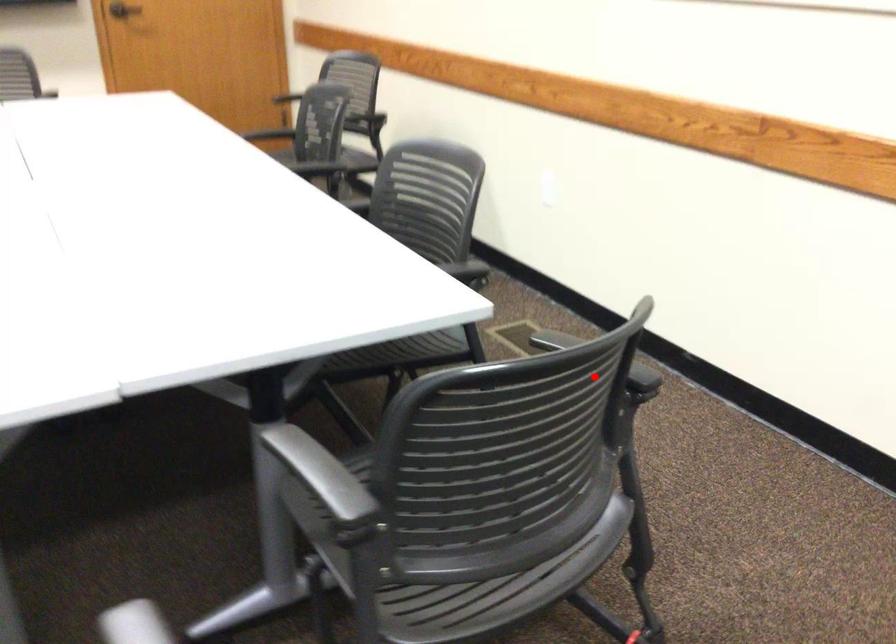
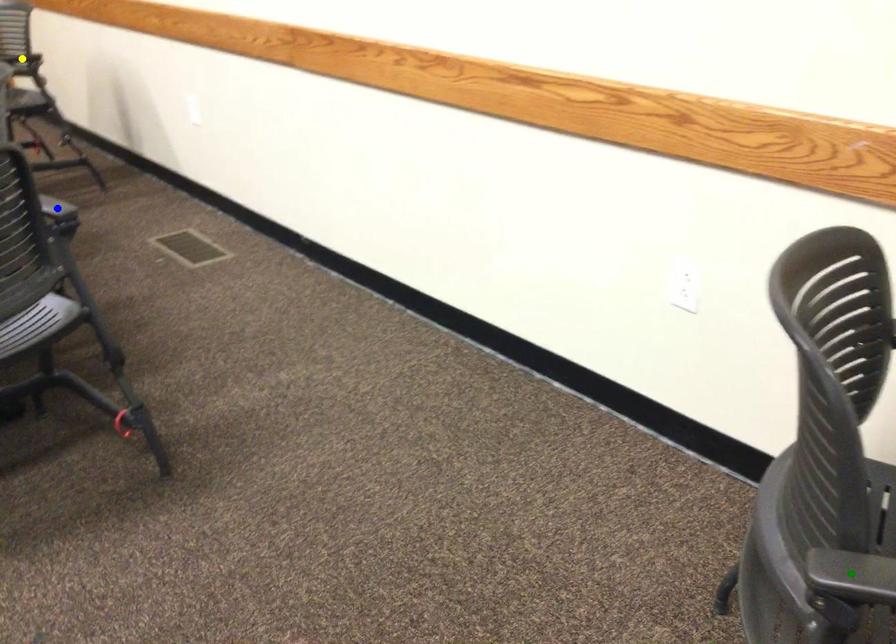
Question: I am providing you with two images of the same scene from different viewpoints. A red point is marked on the first image. You are given multiple points on the second image. Which mark in image 2 goes with the point in image 1?

Choices:
 (A) yellow point
 (B) blue point
 (C) green point

Answer: (B)